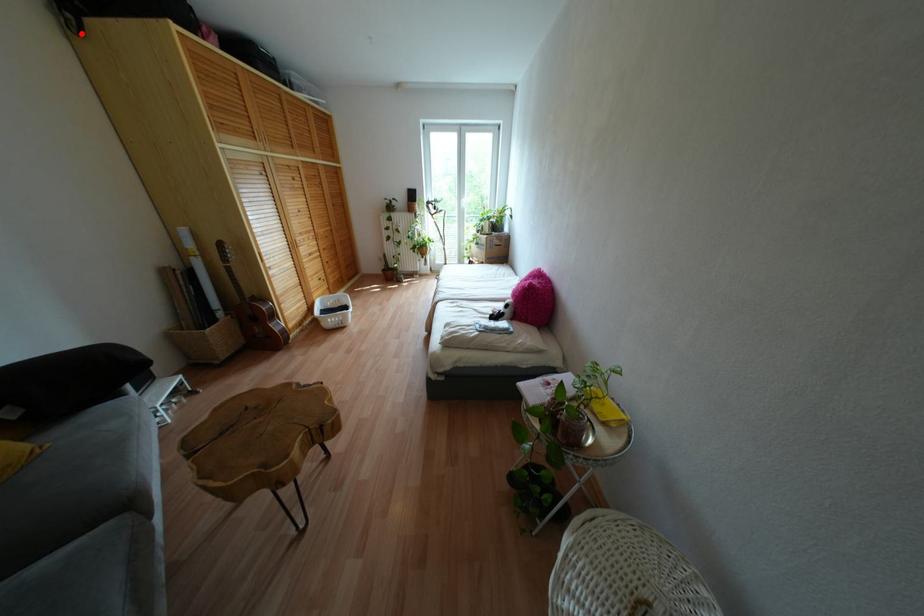
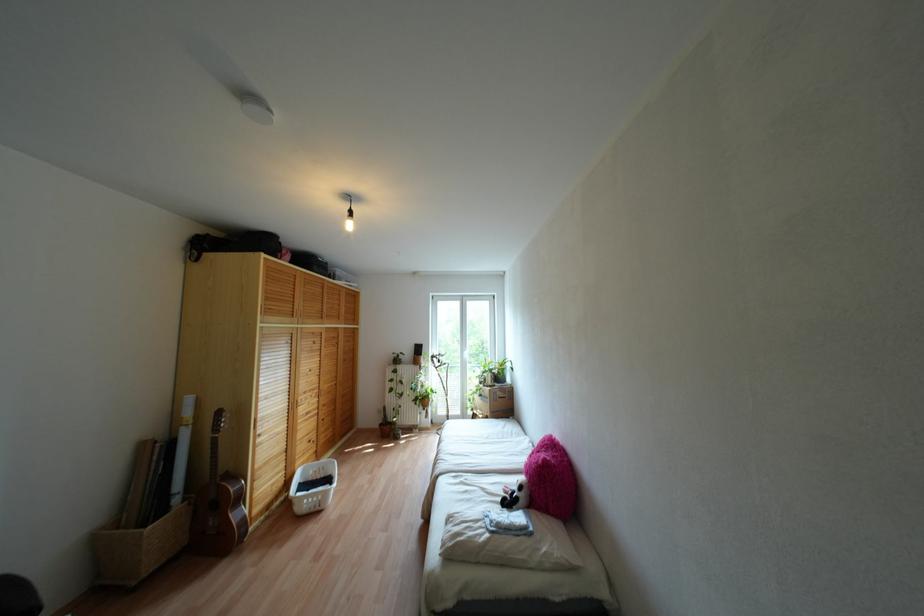
Find the pixel in the second image that matches the highlighted location in the first image.

(196, 260)